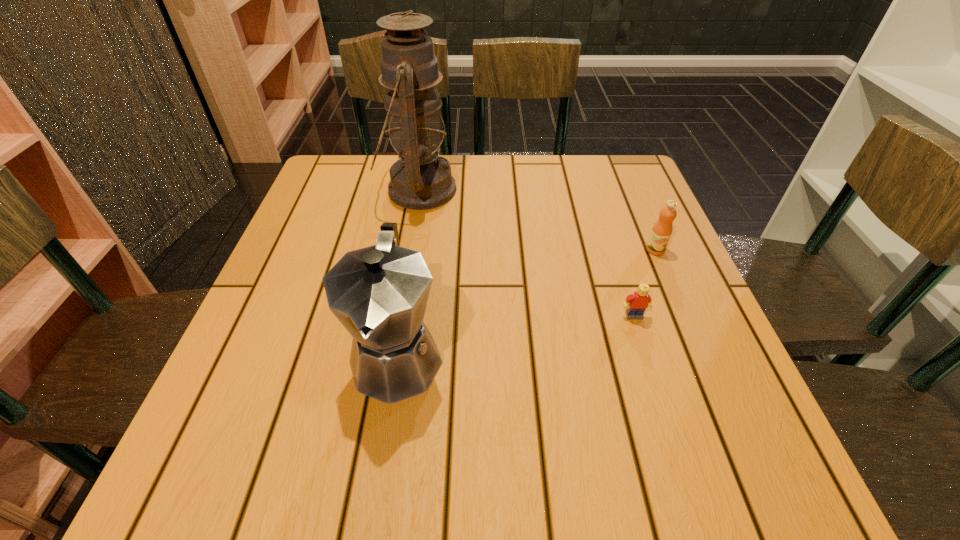
At what (x,y) coordinates should I click in order to perform the action: click on free space between the second tallest object and the third object from left to right. Please return your answer as a coordinate pair (x, y). This screenshot has width=960, height=540. Looking at the image, I should click on (516, 336).

Point out which object is positioned as the nearest to the second object from right to left. Please provide its 2D coordinates. Your answer should be formatted as a tuple, i.e. [(x, y)], where the tuple contains the x and y coordinates of a point satisfying the conditions above.

[(661, 232)]

Select which object appears as the closest to the tallest object. Please provide its 2D coordinates. Your answer should be formatted as a tuple, i.e. [(x, y)], where the tuple contains the x and y coordinates of a point satisfying the conditions above.

[(379, 293)]